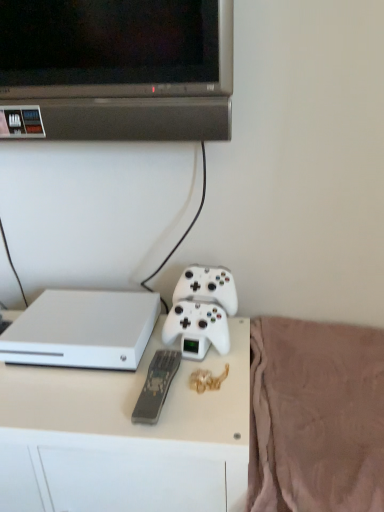
The width and height of the screenshot is (384, 512). What are the coordinates of `unoccupied area in front of gray matte remote at center` in the screenshot? It's located at (168, 429).